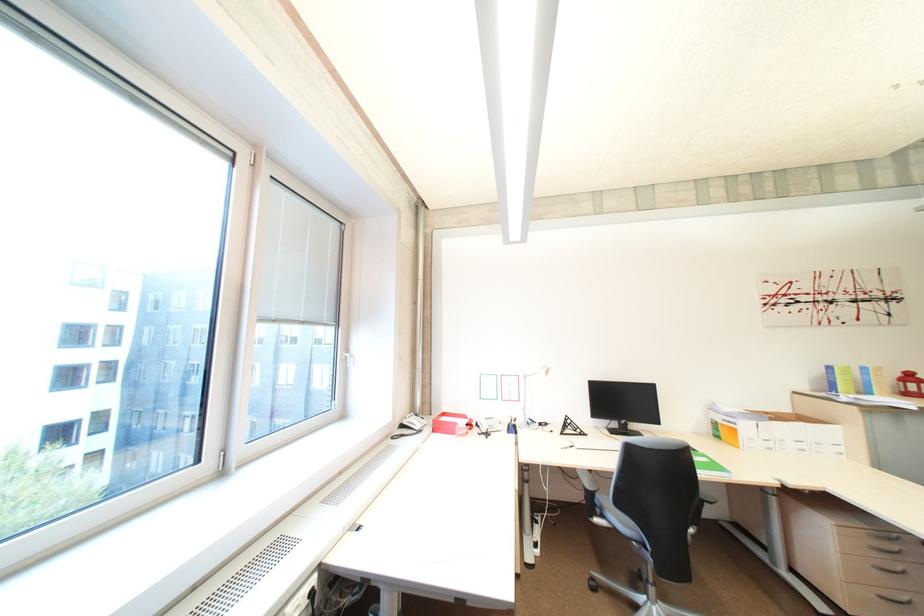
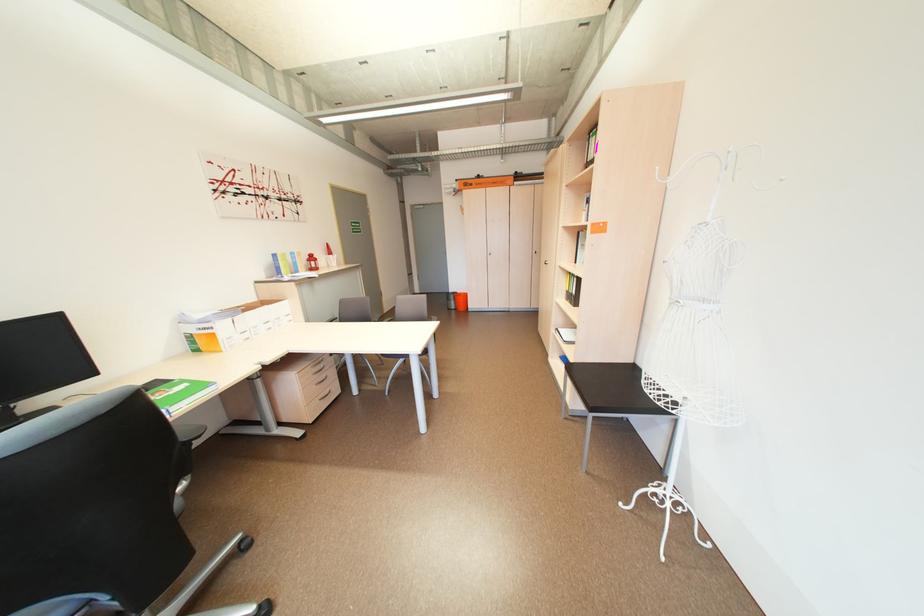
Find the pixel in the second image that matches pixel 713 493 in the first image.

(193, 436)